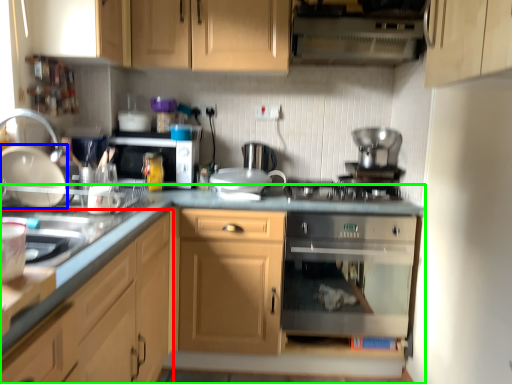
Question: Which is nearer to the cabinetry (highlighted by a red box)? kitchen appliance (highlighted by a blue box) or cabinetry (highlighted by a green box).

Choices:
 (A) kitchen appliance
 (B) cabinetry

Answer: (B)